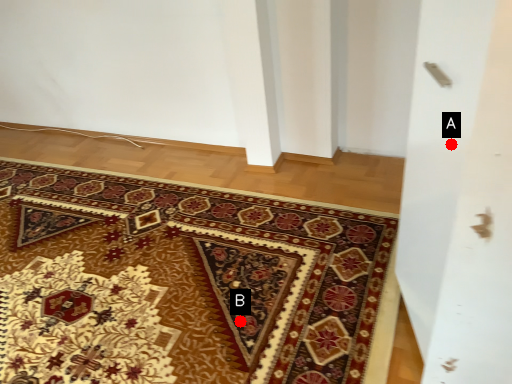
Question: Two points are circled on the image, labeled by A and B beside each circle. Which point is closer to the camera?

Choices:
 (A) A is closer
 (B) B is closer

Answer: (A)